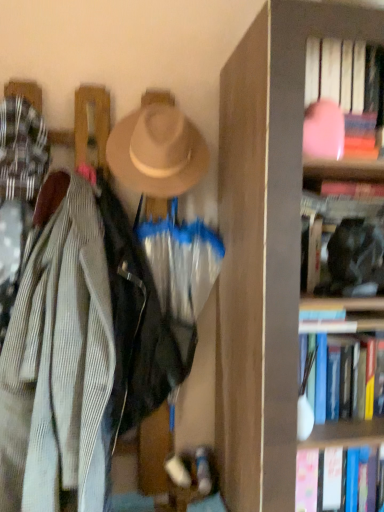
Question: Does pink matte book at upper right, which ranks as the third book in bottom-to-top order, have a smaller size compared to hardcover book at right, positioned as the third book in top-to-bottom order?

Choices:
 (A) no
 (B) yes

Answer: (B)

Question: Does pink matte book at upper right, which ranks as the third book in bottom-to-top order, come in front of hardcover book at right, positioned as the third book in top-to-bottom order?

Choices:
 (A) yes
 (B) no

Answer: (A)

Question: Can you confirm if pink matte book at upper right, the first book in the top-to-bottom sequence, is bigger than hardcover book at right, which is the 1th book in bottom-to-top order?

Choices:
 (A) yes
 (B) no

Answer: (B)

Question: Is pink matte book at upper right, which ranks as the third book in bottom-to-top order, wider than hardcover book at right, positioned as the third book in top-to-bottom order?

Choices:
 (A) yes
 (B) no

Answer: (B)

Question: From a real-world perspective, is pink matte book at upper right, which ranks as the third book in bottom-to-top order, over hardcover book at right, positioned as the third book in top-to-bottom order?

Choices:
 (A) no
 (B) yes

Answer: (B)

Question: Is pink matte book at upper right, which ranks as the third book in bottom-to-top order, thinner than hardcover book at right, which is the 1th book in bottom-to-top order?

Choices:
 (A) no
 (B) yes

Answer: (B)

Question: From the image's perspective, is hardcover book at right, which is the 1th book in bottom-to-top order, below pink matte book at upper right, the first book in the top-to-bottom sequence?

Choices:
 (A) yes
 (B) no

Answer: (A)

Question: Is hardcover book at right, which is the 1th book in bottom-to-top order, taller than pink matte book at upper right, the first book in the top-to-bottom sequence?

Choices:
 (A) yes
 (B) no

Answer: (B)

Question: From a real-world perspective, is hardcover book at right, which is the 1th book in bottom-to-top order, located higher than pink matte book at upper right, the first book in the top-to-bottom sequence?

Choices:
 (A) yes
 (B) no

Answer: (B)

Question: Does hardcover book at right, positioned as the third book in top-to-bottom order, touch pink matte book at upper right, which ranks as the third book in bottom-to-top order?

Choices:
 (A) no
 (B) yes

Answer: (A)

Question: Does hardcover book at right, positioned as the third book in top-to-bottom order, have a smaller size compared to pink matte book at upper right, which ranks as the third book in bottom-to-top order?

Choices:
 (A) no
 (B) yes

Answer: (A)

Question: Is hardcover book at right, which is the 1th book in bottom-to-top order, wider than pink matte book at upper right, the first book in the top-to-bottom sequence?

Choices:
 (A) no
 (B) yes

Answer: (B)

Question: Is pink matte book at upper right, the first book in the top-to-bottom sequence, at the left side of black matte bookshelf at upper right, the second book when ordered from bottom to top?

Choices:
 (A) yes
 (B) no

Answer: (A)